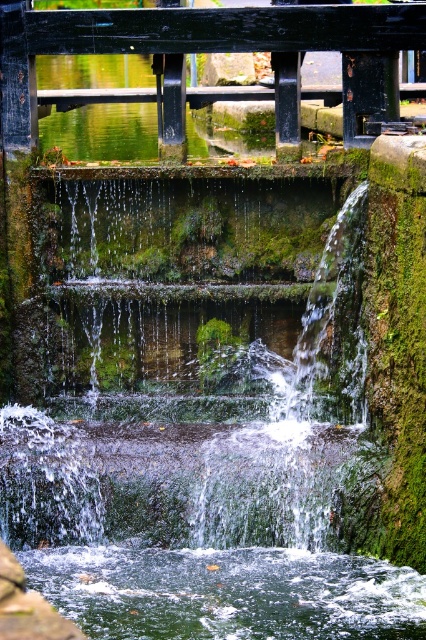
Question: Which point is farther to the camera?

Choices:
 (A) green mossy waterfall at center
 (B) green mossy water at lower center

Answer: (A)

Question: Can you confirm if green mossy waterfall at center is wider than green mossy water at lower center?

Choices:
 (A) yes
 (B) no

Answer: (B)

Question: Does green mossy waterfall at center have a larger size compared to green mossy water at lower center?

Choices:
 (A) yes
 (B) no

Answer: (A)

Question: Is green mossy waterfall at center positioned behind green mossy water at lower center?

Choices:
 (A) yes
 (B) no

Answer: (A)

Question: Which point is farther to the camera?

Choices:
 (A) (345, 596)
 (B) (144, 365)

Answer: (B)